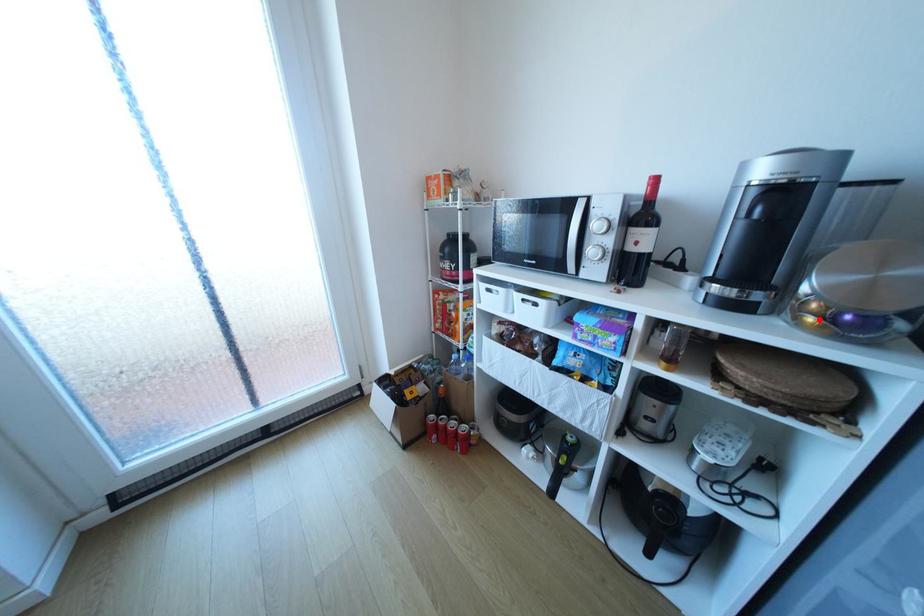
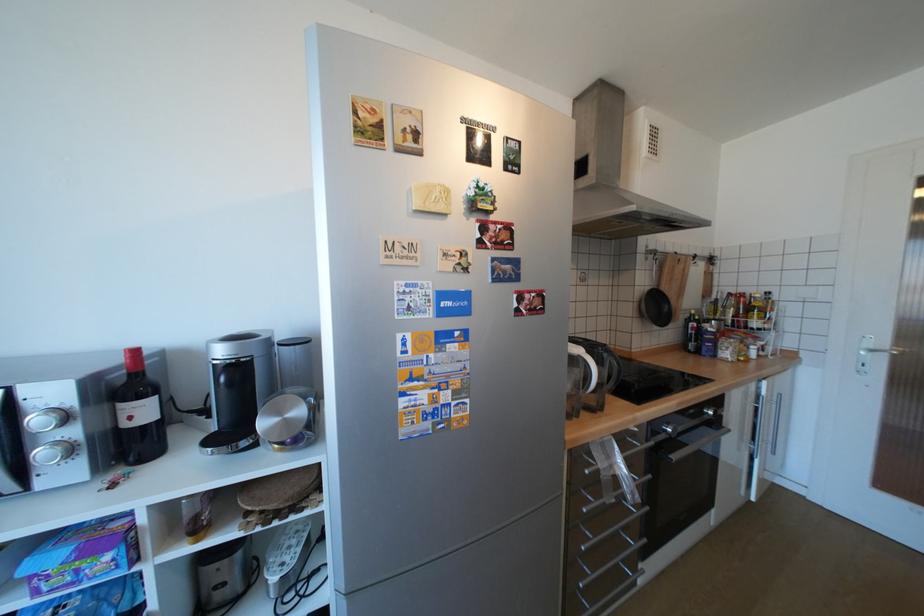
Find the pixel in the second image that matches the highlighted location in the first image.

(286, 446)